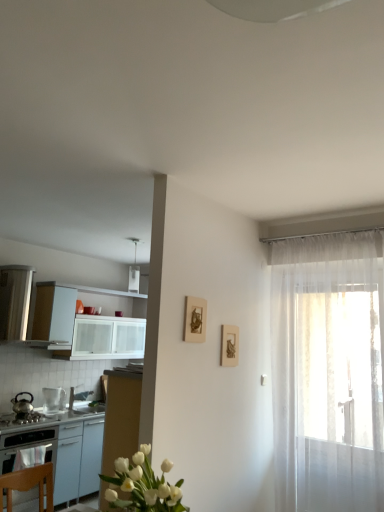
Question: From the image's perspective, is matte gold picture frame at upper center, the second picture frame from the back, above or below wooden picture frame at center-right, placed as the 2th picture frame when sorted from left to right?

Choices:
 (A) below
 (B) above

Answer: (B)

Question: Considering the positions of matte gold picture frame at upper center, the second picture frame from the back, and wooden picture frame at center-right, positioned as the first picture frame in back-to-front order, in the image, is matte gold picture frame at upper center, the second picture frame from the back, wider or thinner than wooden picture frame at center-right, positioned as the first picture frame in back-to-front order,?

Choices:
 (A) thin
 (B) wide

Answer: (B)

Question: Estimate the real-world distances between objects in this image. Which object is closer to the clear glass pitcher at left, which appears as the 2th kitchen appliance when viewed from the left?

Choices:
 (A) wooden picture frame at center-right, positioned as the first picture frame in back-to-front order
 (B) matte gold picture frame at upper center, which is the 1th picture frame in front-to-back order
 (C) white glossy sink at lower left
 (D) translucent white curtain at right
 (E) shiny metallic kettle at left, which ranks as the second kitchen appliance in right-to-left order

Answer: (C)

Question: Estimate the real-world distances between objects in this image. Which object is farther from the translucent white curtain at right?

Choices:
 (A) shiny metallic kettle at left, marked as the 1th kitchen appliance in a left-to-right arrangement
 (B) white glossy sink at lower left
 (C) matte gold picture frame at upper center, arranged as the 2th picture frame when viewed from the right
 (D) wooden picture frame at center-right, which ranks as the first picture frame in right-to-left order
 (E) white glossy cabinet at left

Answer: (A)